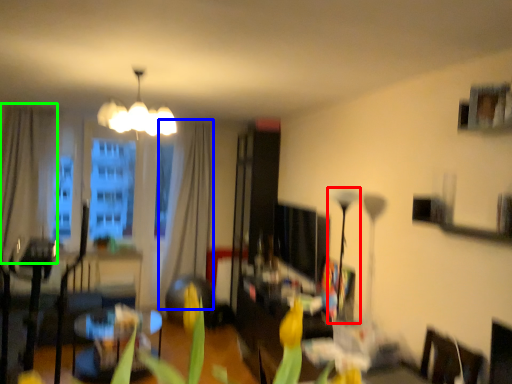
Question: Which object is positioned farthest from lamp (highlighted by a red box)? Select from curtain (highlighted by a blue box) and curtain (highlighted by a green box).

Choices:
 (A) curtain
 (B) curtain

Answer: (B)